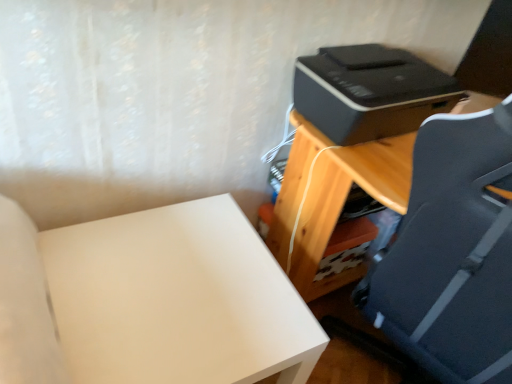
Image resolution: width=512 pixels, height=384 pixels. Describe the element at coordinates (331, 198) in the screenshot. I see `wooden desk at right` at that location.

What do you see at coordinates (370, 92) in the screenshot?
I see `black plastic printer at upper right` at bounding box center [370, 92].

Find the location of `wooden desk at right`. wooden desk at right is located at coordinates (331, 198).

How different are the orientations of black plastic printer at upper right and wooden desk at right in degrees?

black plastic printer at upper right and wooden desk at right are facing 89.9 degrees away from each other.

Who is more distant, black plastic printer at upper right or wooden desk at right?

black plastic printer at upper right.

Who is bigger, black plastic printer at upper right or wooden desk at right?

wooden desk at right is bigger.

Can you confirm if wooden desk at right is taller than black plastic printer at upper right?

Correct, wooden desk at right is much taller as black plastic printer at upper right.

Can you confirm if wooden desk at right is positioned to the right of black plastic printer at upper right?

Yes, wooden desk at right is to the right of black plastic printer at upper right.

From a real-world perspective, is wooden desk at right positioned above or below black plastic printer at upper right?

In terms of real-world spatial position, wooden desk at right is below black plastic printer at upper right.

Is wooden desk at right aimed at black plastic printer at upper right?

No.

Can you confirm if wooden desk at right is thinner than white matte table at lower left?

In fact, wooden desk at right might be wider than white matte table at lower left.

Which object is further away from the camera taking this photo, wooden desk at right or white matte table at lower left?

white matte table at lower left is behind.

Considering the sizes of objects wooden desk at right and white matte table at lower left in the image provided, who is taller, wooden desk at right or white matte table at lower left?

wooden desk at right is taller.

Would you consider wooden desk at right to be distant from white matte table at lower left?

That's not correct — wooden desk at right is a little close to white matte table at lower left.

Is white matte table at lower left in front of or behind wooden desk at right in the image?

Visually, white matte table at lower left is located behind wooden desk at right.

Who is bigger, white matte table at lower left or wooden desk at right?

Bigger between the two is wooden desk at right.

Is white matte table at lower left located outside wooden desk at right?

Yes, white matte table at lower left is outside of wooden desk at right.

Is point (2, 357) less distant than point (293, 236)?

That is True.

Which object is closer to the camera, white matte table at lower left or black plastic printer at upper right?

white matte table at lower left.

Between white matte table at lower left and black plastic printer at upper right, which one has smaller width?

Thinner between the two is black plastic printer at upper right.

Is white matte table at lower left positioned with its back to black plastic printer at upper right?

That's not correct — white matte table at lower left is not looking away from black plastic printer at upper right.

In the scene shown: Does white matte table at lower left have a larger size compared to black plastic printer at upper right?

Yes.

From a real-world perspective, is black plastic printer at upper right beneath white matte table at lower left?

No, from a real-world perspective, black plastic printer at upper right is not below white matte table at lower left.

Which point is more forward, (358, 141) or (62, 328)?

Point (62, 328)

In the scene shown: Is black plastic printer at upper right taller than white matte table at lower left?

In fact, black plastic printer at upper right may be shorter than white matte table at lower left.

The image size is (512, 384). In the image, there is a black plastic printer at upper right. Identify the location of table below it (from a real-world perspective). (331, 198).

The width and height of the screenshot is (512, 384). I want to click on printer on the left of wooden desk at right, so click(370, 92).

Which object lies further to the anchor point wooden desk at right, white matte table at lower left or black plastic printer at upper right?

The object further to wooden desk at right is white matte table at lower left.

When comparing their distances from black plastic printer at upper right, does white matte table at lower left or wooden desk at right seem closer?

wooden desk at right is positioned closer to the anchor black plastic printer at upper right.

Considering their positions, is black plastic printer at upper right positioned further to wooden desk at right than white matte table at lower left?

white matte table at lower left is positioned further to the anchor wooden desk at right.

In the scene shown: Estimate the real-world distances between objects in this image. Which object is closer to white matte table at lower left, wooden desk at right or black plastic printer at upper right?

wooden desk at right is positioned closer to the anchor white matte table at lower left.

Looking at the image, which one is located closer to white matte table at lower left, black plastic printer at upper right or wooden desk at right?

wooden desk at right is positioned closer to the anchor white matte table at lower left.

Estimate the real-world distances between objects in this image. Which object is closer to black plastic printer at upper right, wooden desk at right or white matte table at lower left?

wooden desk at right is positioned closer to the anchor black plastic printer at upper right.

Locate an element on the screen. Image resolution: width=512 pixels, height=384 pixels. printer located between white matte table at lower left and wooden desk at right in the left-right direction is located at coordinates (370, 92).